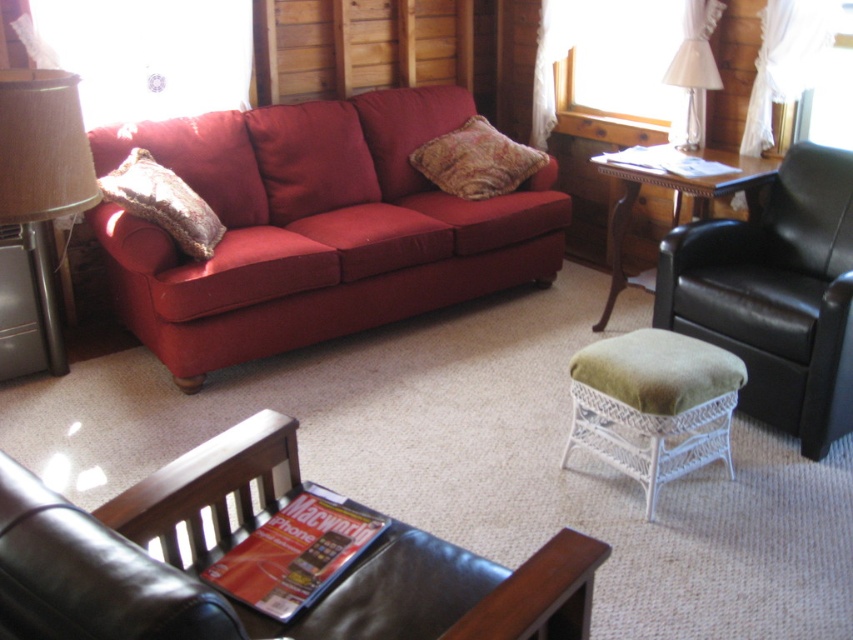
You are planning to rearrange the living room and want to place a new rectangular coffee table between the brown leather armchair at lower left and the burlap lampshade at left. If the coffee table is 1.2 meters long, will it fit between them?

The brown leather armchair at lower left is larger in size than the burlap lampshade at left, but the exact distance between them isn

You are a guest sitting in the brown leather armchair at lower left and want to reach the burlap lampshade at left to adjust the light. Can you comfortably reach it without standing up?

The brown leather armchair at lower left is shorter than the burlap lampshade at left, so you might not be able to comfortably reach it without standing up because the lampshade is taller than the armchair.

Consider the image. You are standing in the living room and need to place a small lamp on the wooden table at center right. According to the coordinates given, where exactly should you place the lamp?

The wooden table at center right is located at coordinates point [676,196], so place the lamp there.